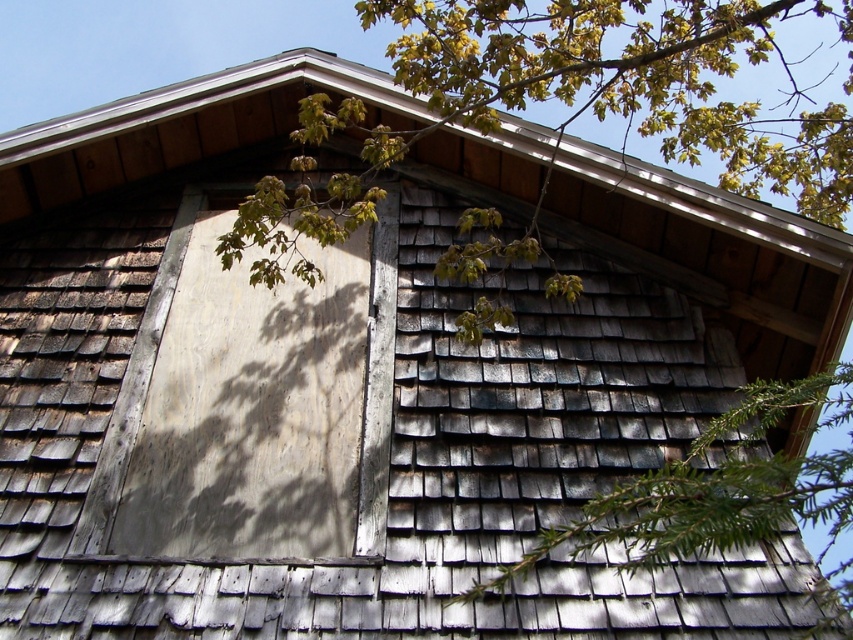
Between white wood board at center and green textured pine branch at center, which one has less height?

Standing shorter between the two is green textured pine branch at center.

Is white wood board at center bigger than green textured pine branch at center?

Correct, white wood board at center is larger in size than green textured pine branch at center.

Describe the element at coordinates (252, 404) in the screenshot. I see `white wood board at center` at that location.

The width and height of the screenshot is (853, 640). In order to click on white wood board at center in this screenshot , I will do `click(252, 404)`.